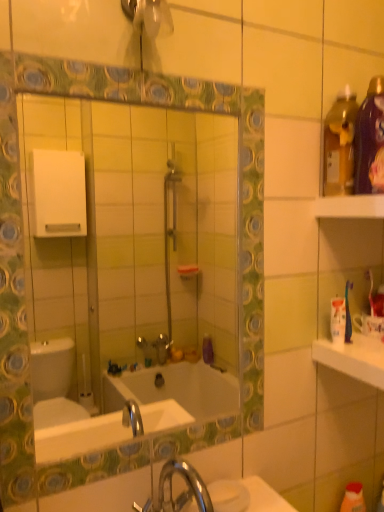
Question: From a real-world perspective, is green glossy mirror at center positioned under white plastic shelf at upper right based on gravity?

Choices:
 (A) yes
 (B) no

Answer: (A)

Question: Is green glossy mirror at center facing towards white plastic shelf at upper right?

Choices:
 (A) no
 (B) yes

Answer: (A)

Question: Does green glossy mirror at center have a greater height compared to white plastic shelf at upper right?

Choices:
 (A) no
 (B) yes

Answer: (B)

Question: Can you confirm if green glossy mirror at center is wider than white plastic shelf at upper right?

Choices:
 (A) no
 (B) yes

Answer: (A)

Question: Is green glossy mirror at center positioned far away from white plastic shelf at upper right?

Choices:
 (A) no
 (B) yes

Answer: (B)

Question: Considering the relative positions of green glossy mirror at center and white plastic shelf at upper right in the image provided, is green glossy mirror at center in front of white plastic shelf at upper right?

Choices:
 (A) yes
 (B) no

Answer: (A)

Question: Could green glossy mirror at center be considered to be inside white plastic shelf at upper right?

Choices:
 (A) no
 (B) yes

Answer: (A)

Question: Does white plastic shelf at upper right have a larger size compared to green glossy mirror at center?

Choices:
 (A) no
 (B) yes

Answer: (A)

Question: Is white plastic shelf at upper right thinner than green glossy mirror at center?

Choices:
 (A) yes
 (B) no

Answer: (B)

Question: Considering the relative sizes of white plastic shelf at upper right and green glossy mirror at center in the image provided, is white plastic shelf at upper right shorter than green glossy mirror at center?

Choices:
 (A) yes
 (B) no

Answer: (A)

Question: Is white plastic shelf at upper right taller than green glossy mirror at center?

Choices:
 (A) yes
 (B) no

Answer: (B)

Question: Is white plastic shelf at upper right next to green glossy mirror at center?

Choices:
 (A) yes
 (B) no

Answer: (B)

Question: From the image's perspective, is white glossy countertop at right below white plastic shelf at upper right?

Choices:
 (A) yes
 (B) no

Answer: (A)